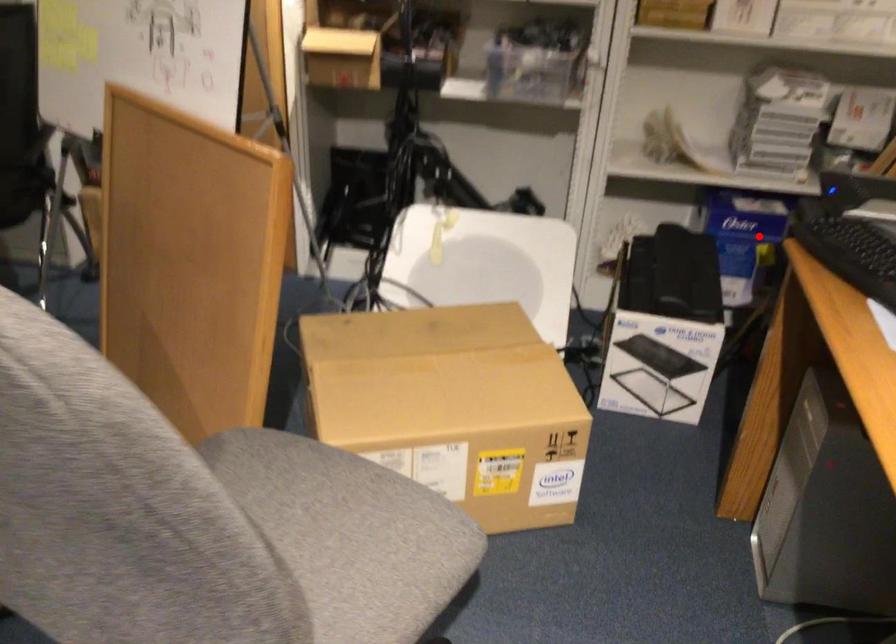
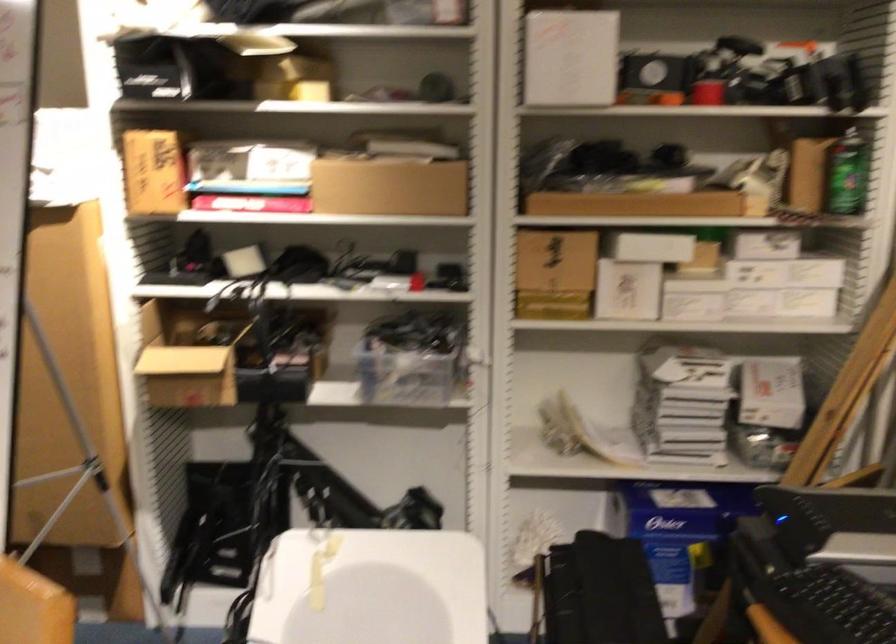
Question: I am providing you with two images of the same scene from different viewpoints. In image1, a red point is highlighted. Considering the same 3D point in image2, which of the following is correct?

Choices:
 (A) It is closer
 (B) It is farther

Answer: (A)